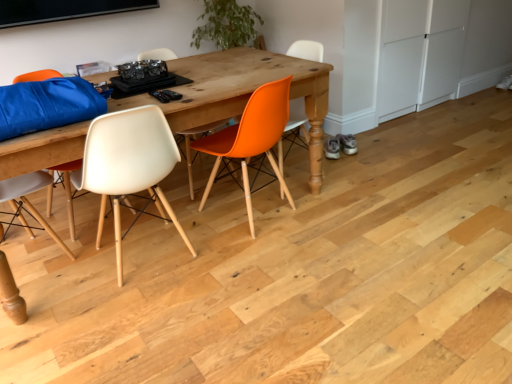
Question: Is the position of orange matte chair at center, which is counted as the 2th chair, starting from the left, more distant than that of wooden table at center?

Choices:
 (A) yes
 (B) no

Answer: (A)

Question: Is orange matte chair at center, which is counted as the 2th chair, starting from the left, turned away from wooden table at center?

Choices:
 (A) yes
 (B) no

Answer: (A)

Question: From the image's perspective, is orange matte chair at center, arranged as the second chair when viewed from the right, on top of wooden table at center?

Choices:
 (A) no
 (B) yes

Answer: (B)

Question: Is orange matte chair at center, arranged as the second chair when viewed from the right, outside of wooden table at center?

Choices:
 (A) yes
 (B) no

Answer: (B)

Question: Can you confirm if orange matte chair at center, arranged as the second chair when viewed from the right, is thinner than wooden table at center?

Choices:
 (A) yes
 (B) no

Answer: (A)

Question: Would you say orange matte chair at center, which is counted as the 2th chair, starting from the left, contains wooden table at center?

Choices:
 (A) no
 (B) yes

Answer: (A)

Question: Is white matte chair at center, which ranks as the 3th chair in right-to-left order, wider than white matte cabinet at right?

Choices:
 (A) yes
 (B) no

Answer: (A)

Question: Is white matte chair at center, which ranks as the 3th chair in right-to-left order, with white matte cabinet at right?

Choices:
 (A) no
 (B) yes

Answer: (A)

Question: Does white matte chair at center, the 1th chair positioned from the left, appear on the right side of white matte cabinet at right?

Choices:
 (A) no
 (B) yes

Answer: (A)

Question: Does white matte chair at center, which ranks as the 3th chair in right-to-left order, come behind white matte cabinet at right?

Choices:
 (A) yes
 (B) no

Answer: (B)

Question: From the image's perspective, is white matte chair at center, the 1th chair positioned from the left, under white matte cabinet at right?

Choices:
 (A) yes
 (B) no

Answer: (A)

Question: Considering the relative sizes of white matte chair at center, the 1th chair positioned from the left, and white matte cabinet at right in the image provided, is white matte chair at center, the 1th chair positioned from the left, shorter than white matte cabinet at right?

Choices:
 (A) yes
 (B) no

Answer: (A)

Question: Would you say orange matte chair at center, positioned as the 3th chair in left-to-right order, is part of wooden table at center's contents?

Choices:
 (A) no
 (B) yes

Answer: (B)